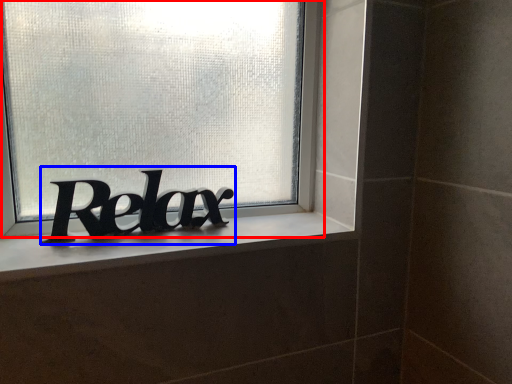
Question: Among these objects, which one is nearest to the camera, window (highlighted by a red box) or lettering (highlighted by a blue box)?

Choices:
 (A) window
 (B) lettering

Answer: (A)